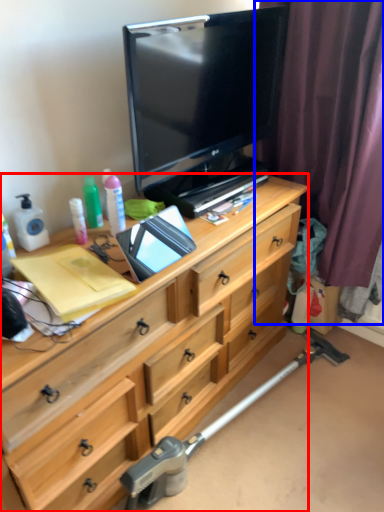
Question: Among these objects, which one is nearest to the camera, chest of drawers (highlighted by a red box) or curtain (highlighted by a blue box)?

Choices:
 (A) chest of drawers
 (B) curtain

Answer: (A)